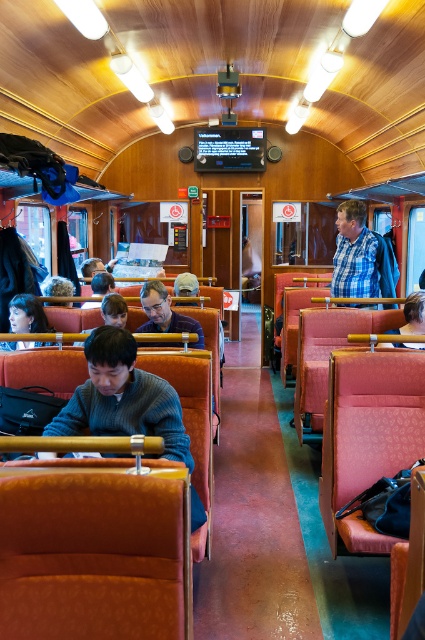
What do you see at coordinates (166, 314) in the screenshot?
I see `matte black sweater at center` at bounding box center [166, 314].

Between point (170, 342) and point (17, 342), which one is positioned behind?

The point (17, 342) is more distant.

This screenshot has width=425, height=640. Find the location of `matte black sweater at center`. matte black sweater at center is located at coordinates (166, 314).